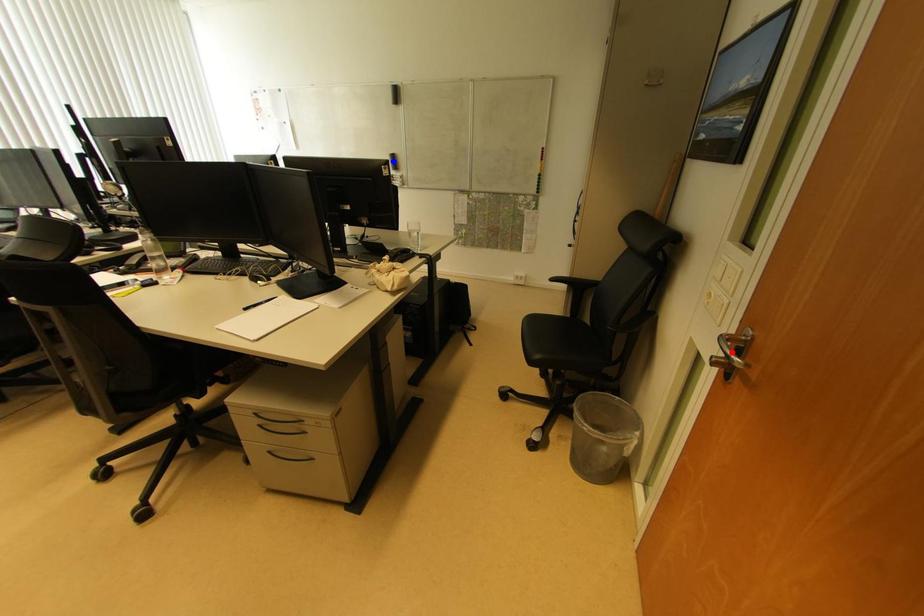
Question: In the image, two points are highlighted. Which point is nearer to the camera? Reply with the corresponding letter.

Choices:
 (A) blue point
 (B) red point

Answer: (B)